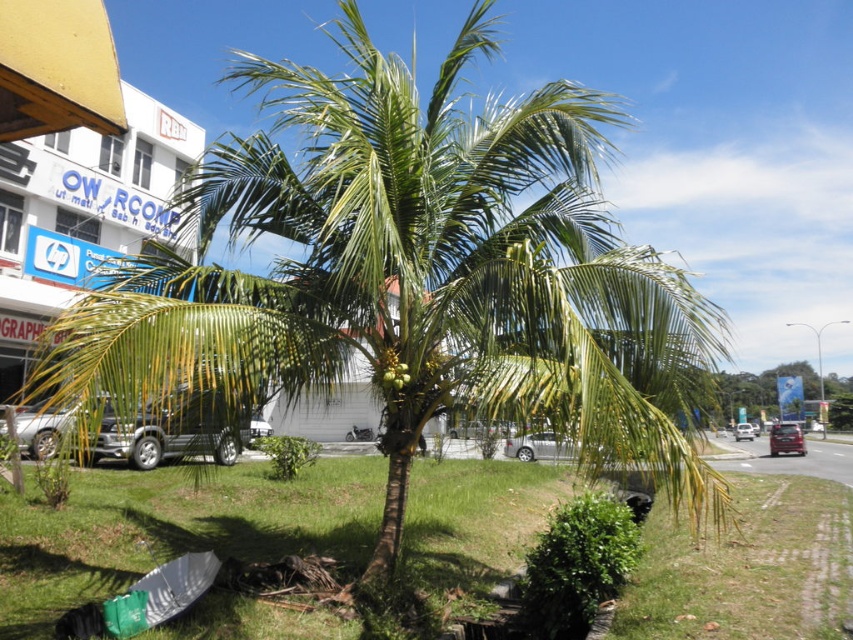
Question: Which object is farther from the camera taking this photo?

Choices:
 (A) silver metallic sedan at center
 (B) silver metallic car at center

Answer: (A)

Question: Is green grass at center thinner than metallic silver car at center?

Choices:
 (A) yes
 (B) no

Answer: (B)

Question: Can you confirm if silver metallic car at center is smaller than silver metallic sedan at center?

Choices:
 (A) yes
 (B) no

Answer: (B)

Question: Which object is farther from the camera taking this photo?

Choices:
 (A) green leafy palm tree at center
 (B) metallic silver car at center
 (C) silver metallic sedan at center
 (D) silver metallic car at center

Answer: (A)

Question: Does green leafy palm tree at center have a larger size compared to metallic silver car at center?

Choices:
 (A) yes
 (B) no

Answer: (A)

Question: Which point is farther to the camera?

Choices:
 (A) click(x=749, y=436)
 (B) click(x=784, y=435)

Answer: (A)